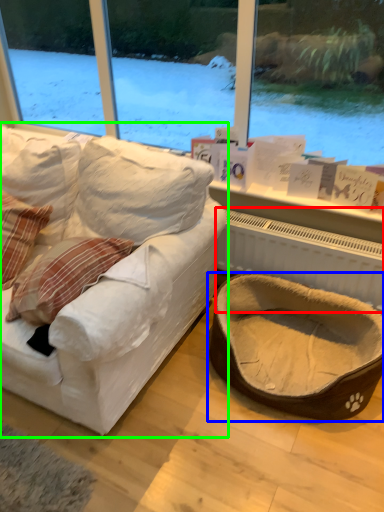
Question: Estimate the real-world distances between objects in this image. Which object is closer to radiator (highlighted by a red box), dog bed (highlighted by a blue box) or studio couch (highlighted by a green box)?

Choices:
 (A) dog bed
 (B) studio couch

Answer: (A)